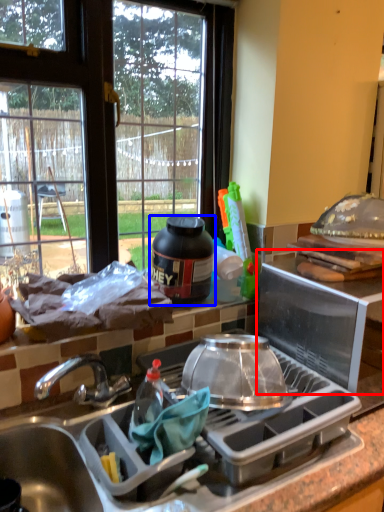
Question: Which of the following is the closest to the observer, appliance (highlighted by a red box) or kitchen appliance (highlighted by a blue box)?

Choices:
 (A) appliance
 (B) kitchen appliance

Answer: (A)